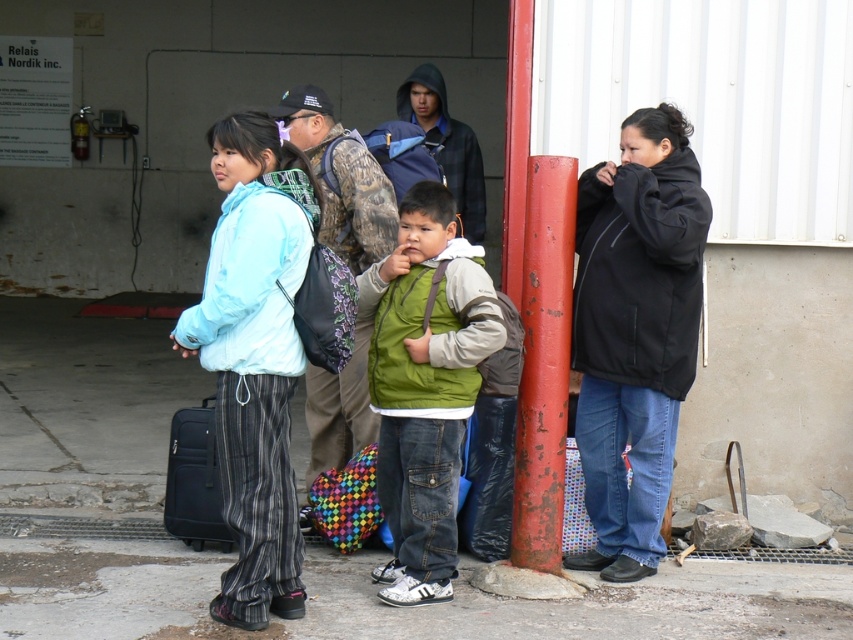
Is black softshell jacket at center below green fabric vest at center?

No, black softshell jacket at center is not below green fabric vest at center.

Describe the element at coordinates (635, 332) in the screenshot. This screenshot has width=853, height=640. I see `black softshell jacket at center` at that location.

Does point (683, 125) come behind point (424, 273)?

Yes, point (683, 125) is farther from viewer.

This screenshot has height=640, width=853. In order to click on black softshell jacket at center in this screenshot , I will do `click(635, 332)`.

Is black softshell jacket at center closer to camera compared to matte black suitcase at lower left?

Yes, it is in front of matte black suitcase at lower left.

Describe the element at coordinates (635, 332) in the screenshot. The width and height of the screenshot is (853, 640). I see `black softshell jacket at center` at that location.

Where is `black softshell jacket at center`? The height and width of the screenshot is (640, 853). black softshell jacket at center is located at coordinates click(x=635, y=332).

The width and height of the screenshot is (853, 640). Describe the element at coordinates (425, 385) in the screenshot. I see `green fabric vest at center` at that location.

At what (x,y) coordinates should I click in order to perform the action: click on green fabric vest at center. Please return your answer as a coordinate pair (x, y). The height and width of the screenshot is (640, 853). Looking at the image, I should click on [x=425, y=385].

This screenshot has height=640, width=853. In order to click on green fabric vest at center in this screenshot , I will do `click(425, 385)`.